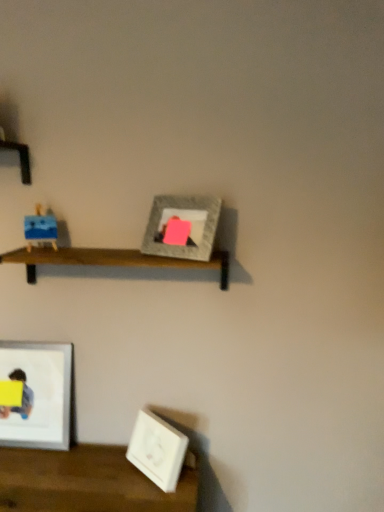
Identify the location of blank space situated above wooden shelf at center (from a real-world perspective). The height and width of the screenshot is (512, 384). (108, 250).